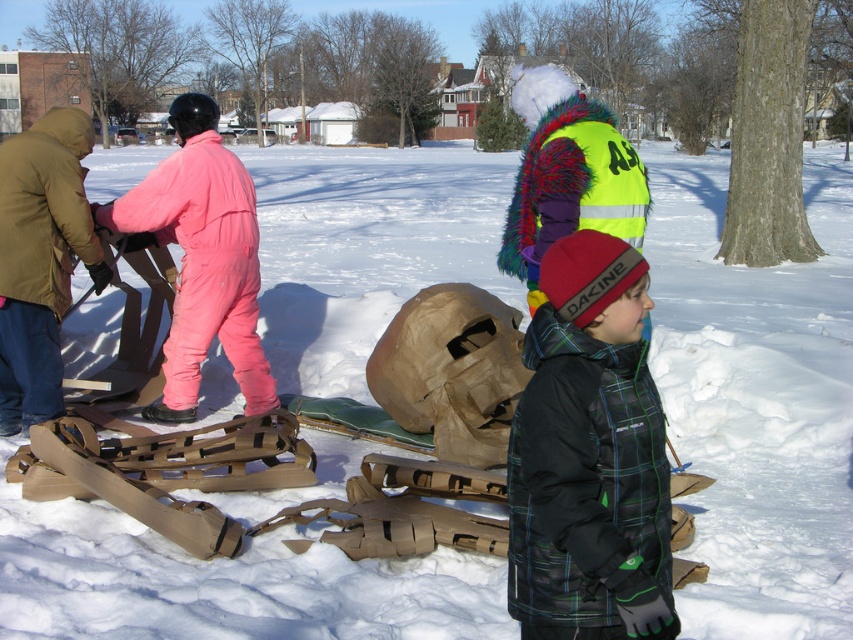
Based on the photo, can you confirm if pink matte snowsuit at left is shorter than brown leather gloves at left?

No.

Who is lower down, pink matte snowsuit at left or brown leather gloves at left?

brown leather gloves at left

The width and height of the screenshot is (853, 640). In order to click on pink matte snowsuit at left in this screenshot , I will do `click(200, 259)`.

Who is taller, black plaid jacket at center or pink matte snowsuit at left?

With more height is pink matte snowsuit at left.

Describe the element at coordinates (589, 456) in the screenshot. Image resolution: width=853 pixels, height=640 pixels. I see `black plaid jacket at center` at that location.

Is point (613, 592) closer to camera compared to point (216, 116)?

Yes, it is.

This screenshot has height=640, width=853. Find the location of `black plaid jacket at center`. black plaid jacket at center is located at coordinates (589, 456).

How much distance is there between black plaid jacket at center and brown leather gloves at left?

The distance of black plaid jacket at center from brown leather gloves at left is 14.91 feet.

Who is higher up, black plaid jacket at center or brown leather gloves at left?

brown leather gloves at left is higher up.

Who is more distant from viewer, (616, 464) or (57, 337)?

Point (57, 337)

Locate an element on the screen. This screenshot has height=640, width=853. black plaid jacket at center is located at coordinates (589, 456).